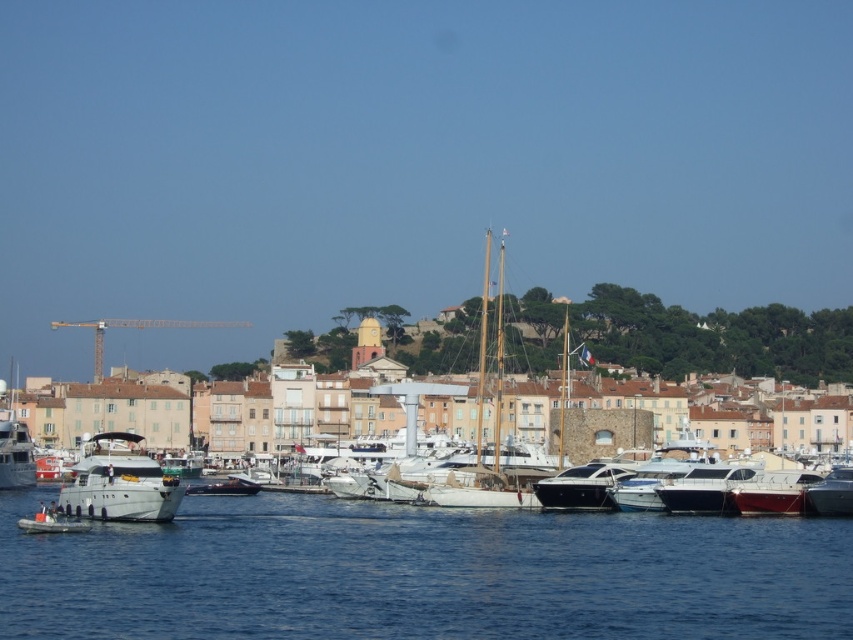
Looking at this image, you are standing on the dock and see the silver metallic yacht at lower left and the shiny white boat at center right. Which boat is positioned closer to the left side of the dock?

The silver metallic yacht at lower left is positioned to the left of the shiny white boat at center right, so it is closer to the left side of the dock.